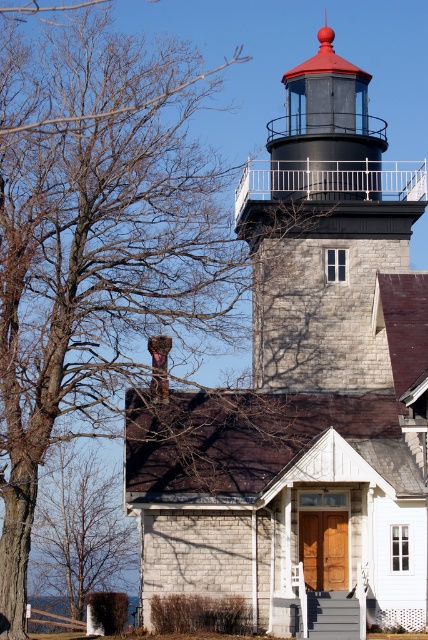
Question: Does dark gray stone lighthouse at center have a smaller size compared to brown bark tree at lower left?

Choices:
 (A) yes
 (B) no

Answer: (B)

Question: Is dark gray stone lighthouse at center positioned at the back of brown bark tree at lower left?

Choices:
 (A) no
 (B) yes

Answer: (A)

Question: Among these points, which one is farthest from the camera?

Choices:
 (A) (269, 330)
 (B) (116, 496)

Answer: (B)

Question: Which point appears closest to the camera in this image?

Choices:
 (A) (338, 164)
 (B) (56, 461)

Answer: (A)

Question: Considering the relative positions of dark gray stone lighthouse at center and brown bark tree at lower left in the image provided, where is dark gray stone lighthouse at center located with respect to brown bark tree at lower left?

Choices:
 (A) left
 (B) right

Answer: (B)